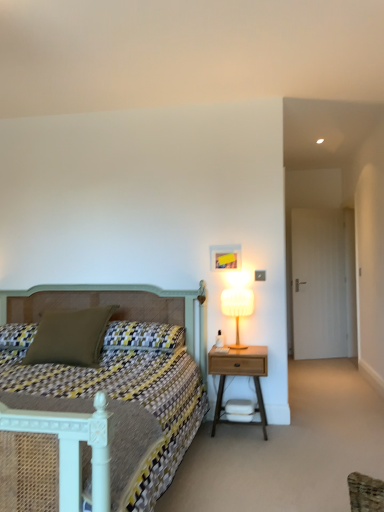
Question: Is patterned fabric bed at center inside or outside of textured olive green pillow at center-left, which appears as the 2th pillow when viewed from the left?

Choices:
 (A) outside
 (B) inside

Answer: (A)

Question: Is patterned fabric bed at center in front of or behind textured olive green pillow at center-left, positioned as the 1th pillow in right-to-left order, in the image?

Choices:
 (A) behind
 (B) front

Answer: (B)

Question: Estimate the real-world distances between objects in this image. Which object is farther from the textured olive green pillow at center-left, which appears as the 2th pillow when viewed from the left?

Choices:
 (A) matte green pillow at left, the second pillow positioned from the right
 (B) white fabric lampshade at right
 (C) patterned fabric bed at center
 (D) wooden nightstand at right

Answer: (B)

Question: Estimate the real-world distances between objects in this image. Which object is farther from the textured olive green pillow at center-left, which appears as the 2th pillow when viewed from the left?

Choices:
 (A) patterned fabric bed at center
 (B) matte green pillow at left, the second pillow positioned from the right
 (C) white fabric lampshade at right
 (D) wooden nightstand at right

Answer: (C)